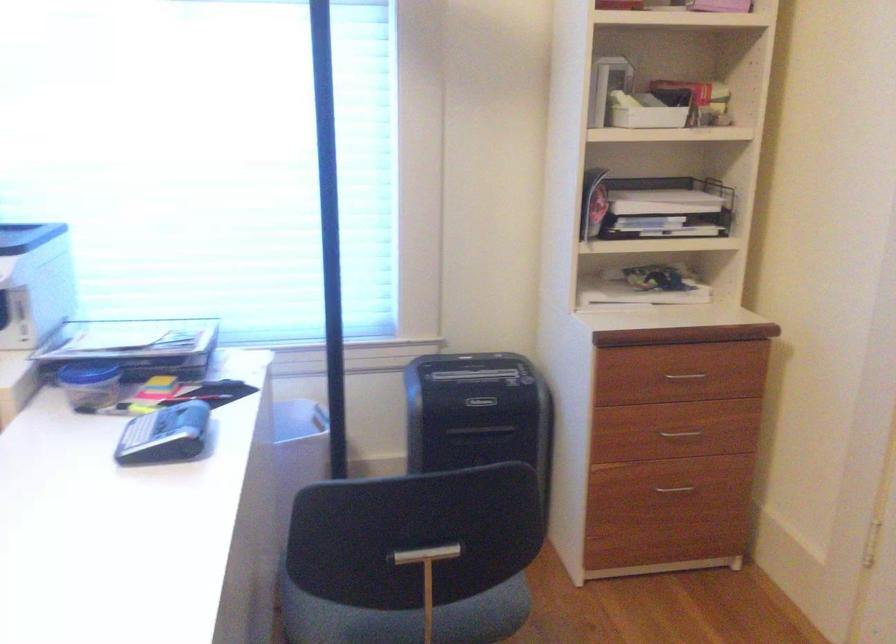
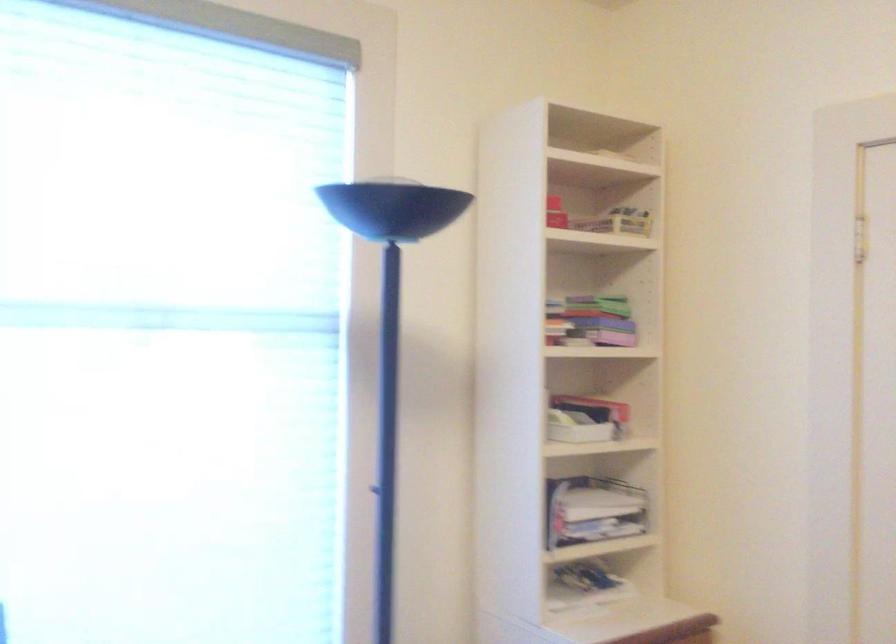
Question: What movement of the cameraman would produce the second image?

Choices:
 (A) Left
 (B) Right
 (C) Forward
 (D) Backward

Answer: (A)